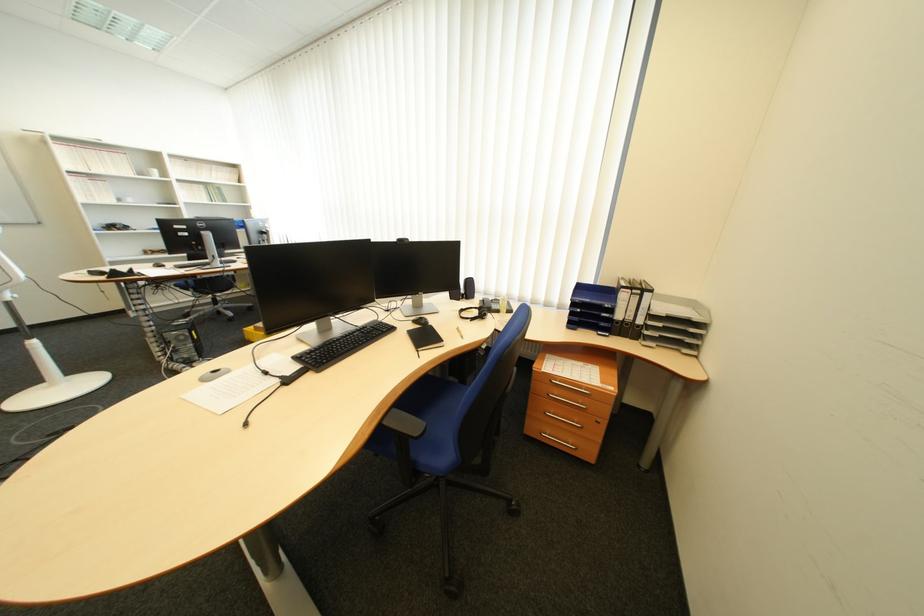
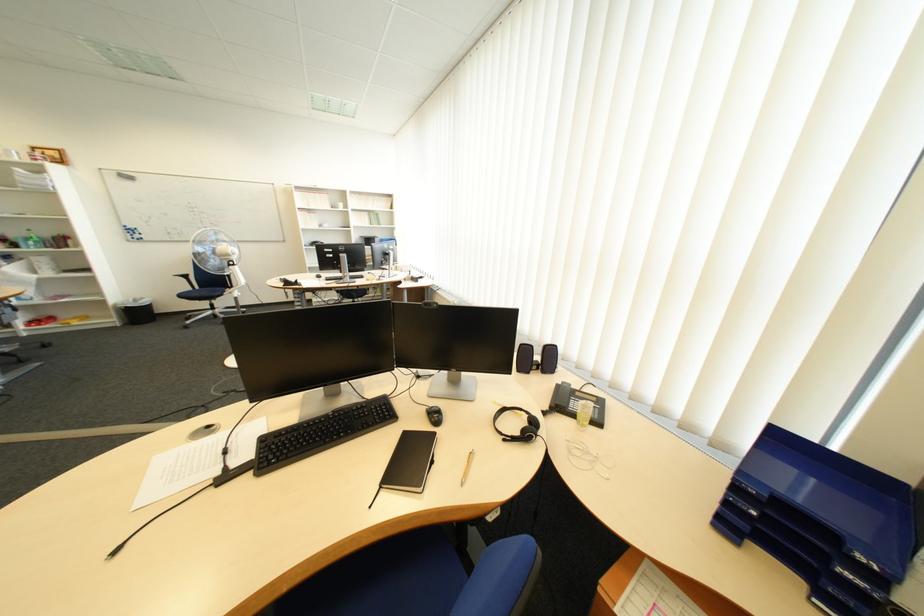
Question: The camera is either moving clockwise (left) or counter-clockwise (right) around the object. The first image is from the beginning of the video and the second image is from the end. Is the camera moving left or right when shooting the video?

Choices:
 (A) Left
 (B) Right

Answer: (B)